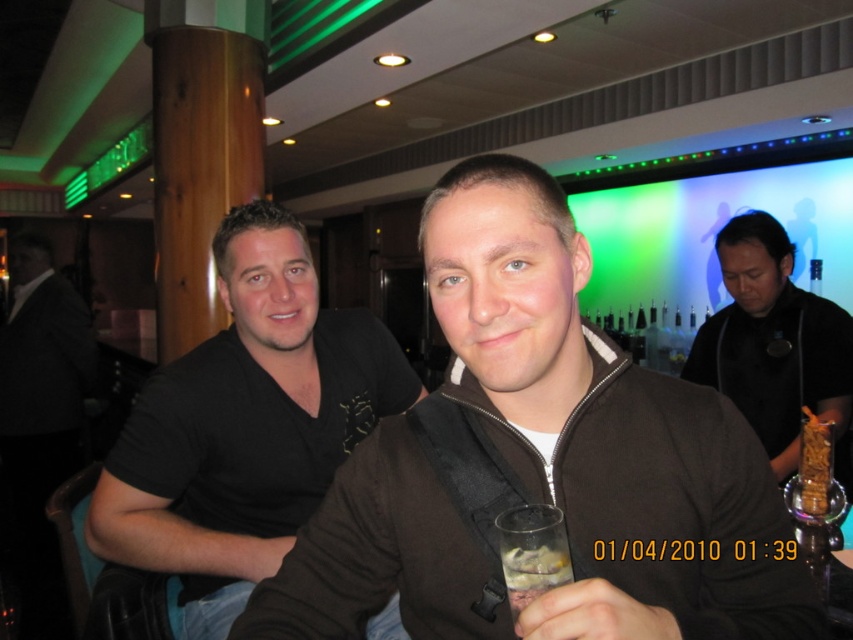
Question: Which of the following is the closest to the observer?

Choices:
 (A) black matte shirt at right
 (B) brown zip-up jacket at center
 (C) clear glass at lower center

Answer: (B)

Question: Which of the following is the closest to the observer?

Choices:
 (A) (341, 410)
 (B) (668, 536)

Answer: (B)

Question: Which of these objects is positioned closest to the clear glass at lower center?

Choices:
 (A) black matte shirt at right
 (B) black matte shirt at left

Answer: (B)

Question: Is black matte shirt at right positioned before clear glass at lower center?

Choices:
 (A) no
 (B) yes

Answer: (A)

Question: From the image, what is the correct spatial relationship of brown zip-up jacket at center in relation to black matte shirt at right?

Choices:
 (A) right
 (B) left

Answer: (B)

Question: Can you confirm if brown zip-up jacket at center is positioned above clear glass at lower center?

Choices:
 (A) yes
 (B) no

Answer: (A)